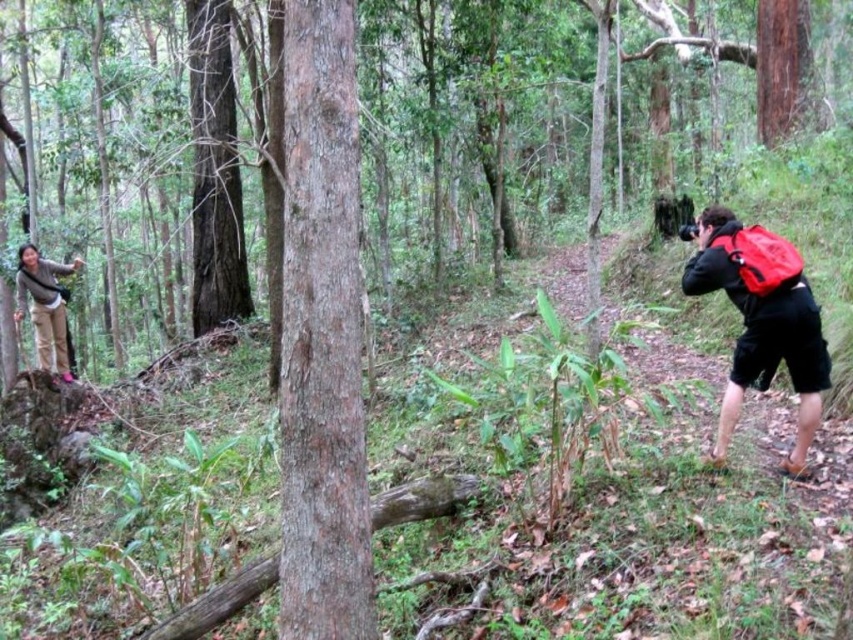
Measure the distance between smooth brown tree trunk at center and red fabric backpack at right.

A distance of 8.07 feet exists between smooth brown tree trunk at center and red fabric backpack at right.

Does point (357, 208) lie in front of point (711, 230)?

Yes, it is.

Is point (328, 588) positioned before point (776, 333)?

Yes, it is in front of point (776, 333).

Locate an element on the screen. This screenshot has height=640, width=853. smooth brown tree trunk at center is located at coordinates [322, 337].

Is point (820, 387) farther from camera compared to point (59, 365)?

No, (820, 387) is closer to viewer.

Who is lower down, red fabric backpack at right or matte beige pants at left?

Positioned lower is matte beige pants at left.

Measure the distance between red fabric backpack at right and camera.

red fabric backpack at right is 3.89 meters from camera.

Locate an element on the screen. The image size is (853, 640). red fabric backpack at right is located at coordinates (761, 321).

Is smooth brown tree trunk at center positioned behind red matte backpack at right?

No, smooth brown tree trunk at center is closer to the viewer.

From the picture: Measure the distance between smooth brown tree trunk at center and camera.

smooth brown tree trunk at center is 8.77 feet away from camera.

This screenshot has height=640, width=853. I want to click on smooth brown tree trunk at center, so click(x=322, y=337).